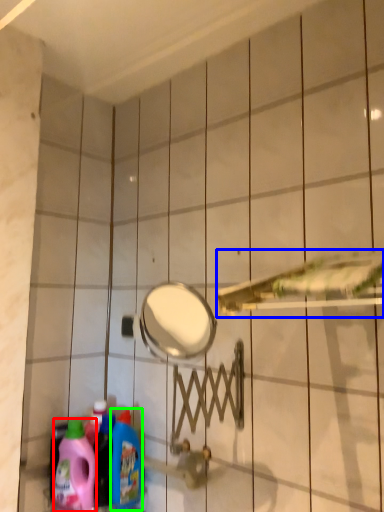
Question: Estimate the real-world distances between objects in this image. Which object is farther from cleaning product (highlighted by a red box), shower (highlighted by a blue box) or cleaning product (highlighted by a green box)?

Choices:
 (A) shower
 (B) cleaning product

Answer: (A)